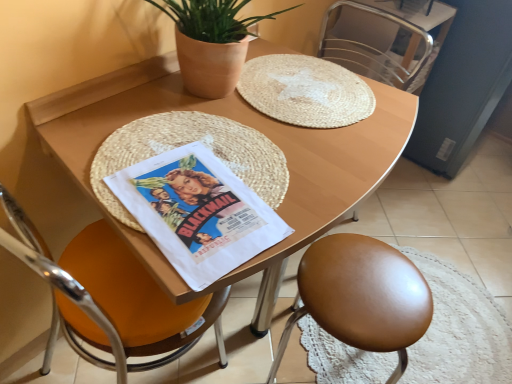
Image resolution: width=512 pixels, height=384 pixels. I want to click on free location above wooden table at center (from a real-world perspective), so click(209, 159).